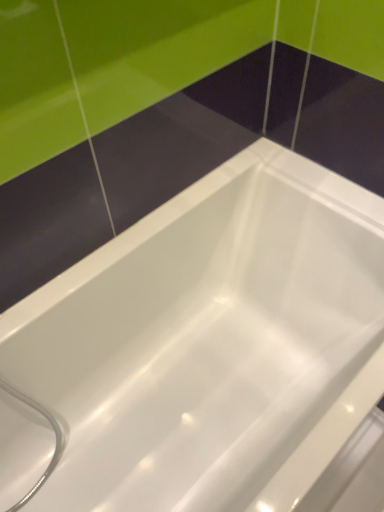
Question: Should I look upward or downward to see white glossy bathtub at center?

Choices:
 (A) down
 (B) up

Answer: (A)